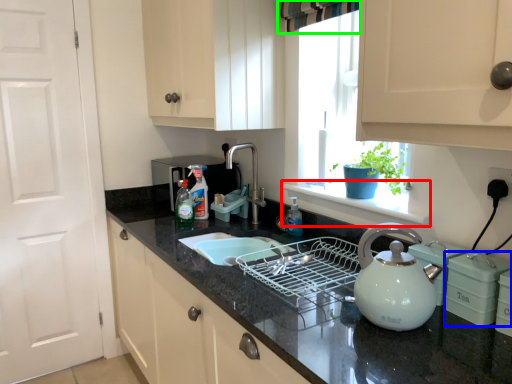
Question: Based on their relative distances, which object is nearer to window sill (highlighted by a red box)? Choose from appliance (highlighted by a blue box) and curtain (highlighted by a green box).

Choices:
 (A) appliance
 (B) curtain

Answer: (A)